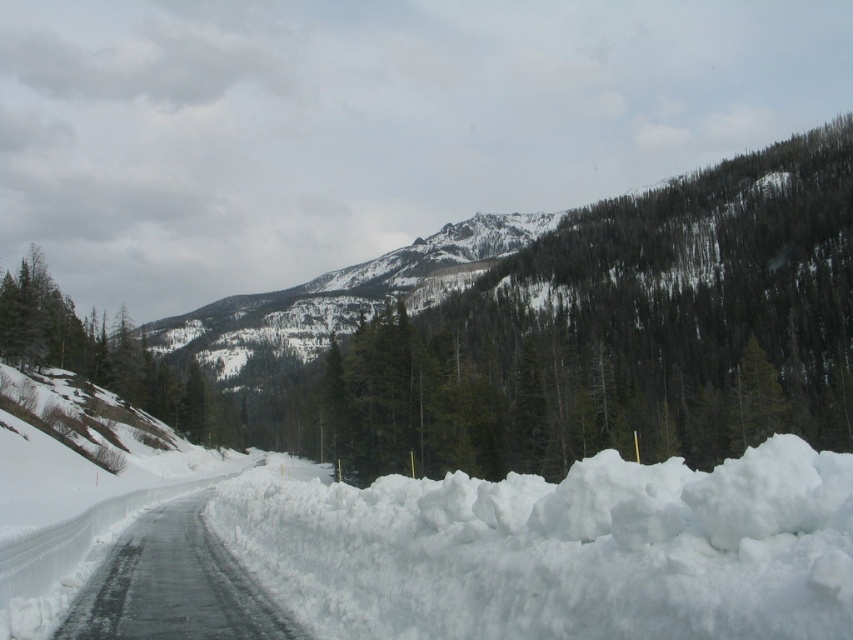
Can you confirm if white fluffy snow at center is shorter than icy asphalt road at center?

No, white fluffy snow at center is not shorter than icy asphalt road at center.

Can you confirm if white fluffy snow at center is smaller than icy asphalt road at center?

No.

What do you see at coordinates (560, 548) in the screenshot? I see `white fluffy snow at center` at bounding box center [560, 548].

This screenshot has width=853, height=640. I want to click on white fluffy snow at center, so click(560, 548).

Is snowy rocky peak at center smaller than icy asphalt road at center?

No, snowy rocky peak at center is not smaller than icy asphalt road at center.

Does point (358, 305) lie behind point (241, 612)?

Yes, it is behind point (241, 612).

Which is in front, point (225, 339) or point (228, 586)?

Point (228, 586)

The height and width of the screenshot is (640, 853). Identify the location of snowy rocky peak at center. (341, 296).

Who is more forward, (x=424, y=554) or (x=306, y=291)?

Point (x=424, y=554) is more forward.

Which is below, white fluffy snow at center or snowy rocky peak at center?

white fluffy snow at center

Find the location of a particular element. Image resolution: width=853 pixels, height=640 pixels. white fluffy snow at center is located at coordinates (560, 548).

This screenshot has height=640, width=853. Identify the location of white fluffy snow at center. (560, 548).